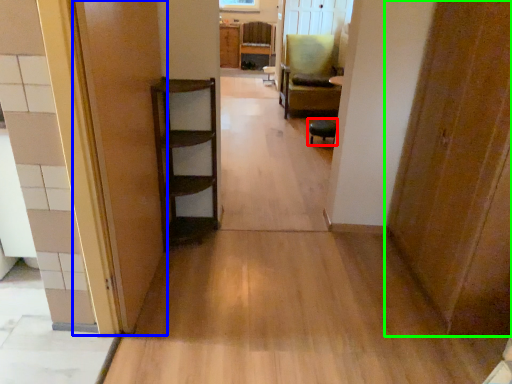
Question: Based on their relative distances, which object is nearer to furniture (highlighted by a red box)? Choose from door (highlighted by a blue box) and door (highlighted by a green box).

Choices:
 (A) door
 (B) door

Answer: (B)